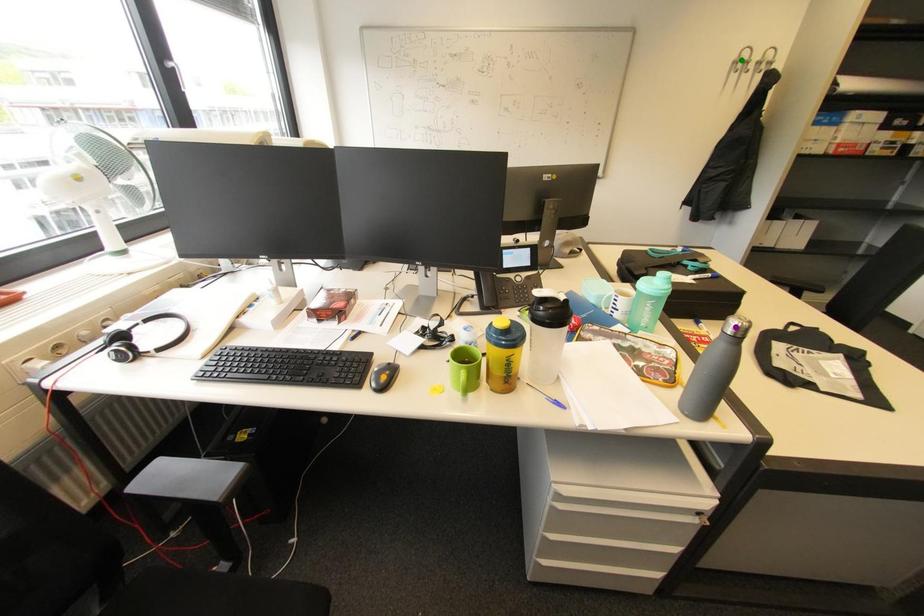
Order these from nearest to farthest:
orange point | purple point | green point

purple point < orange point < green point